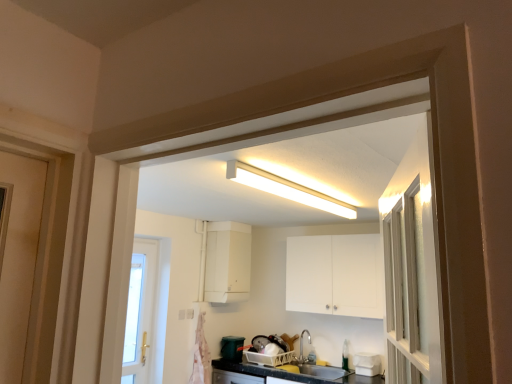
The width and height of the screenshot is (512, 384). What are the coordinates of `white matte cabinet at upper center, positioned as the 2th cabinetry in right-to-left order` in the screenshot? It's located at (226, 262).

What is the approximate width of white matte container at lower right?

9.58 inches.

The width and height of the screenshot is (512, 384). Identify the location of white matte container at lower right. (367, 364).

Image resolution: width=512 pixels, height=384 pixels. Identify the location of white matte cabinet at upper center, which appears as the first cabinetry when viewed from the right. (334, 275).

Which of these two, satin nickel faucet at lower center or white matte cabinet at upper center, which appears as the 1th cabinetry when viewed from the left, is thinner?

With smaller width is satin nickel faucet at lower center.

Is point (308, 339) more distant than point (224, 235)?

No, (308, 339) is closer to viewer.

Is satin nickel faucet at lower center positioned before white matte cabinet at upper center, positioned as the 2th cabinetry in right-to-left order?

Yes, it is in front of white matte cabinet at upper center, positioned as the 2th cabinetry in right-to-left order.

Who is smaller, satin nickel faucet at lower center or white matte cabinet at upper center, positioned as the 2th cabinetry in right-to-left order?

Smaller between the two is satin nickel faucet at lower center.

Which of these two, white fluorescent light at upper center or white matte container at lower right, is thinner?

white fluorescent light at upper center.

Is white fluorescent light at upper center far away from white matte container at lower right?

Indeed, white fluorescent light at upper center is not near white matte container at lower right.

From a real-world perspective, which is physically below, white fluorescent light at upper center or white matte container at lower right?

white matte container at lower right, from a real-world perspective.

Is white matte cabinet at upper center, which appears as the first cabinetry when viewed from the right, next to white matte cabinet at upper center, positioned as the 2th cabinetry in right-to-left order, and touching it?

No, white matte cabinet at upper center, which appears as the first cabinetry when viewed from the right, is not next to white matte cabinet at upper center, positioned as the 2th cabinetry in right-to-left order.

Is white matte cabinet at upper center, marked as the second cabinetry in a left-to-right arrangement, to the right of white matte cabinet at upper center, which appears as the 1th cabinetry when viewed from the left, from the viewer's perspective?

Yes.

Looking at this image, from a real-world perspective, which object rests below the other?

In real-world perspective, white matte cabinet at upper center, marked as the second cabinetry in a left-to-right arrangement, is lower.

Between white plastic electric outlet at lower center and white matte container at lower right, which one has more height?

With more height is white matte container at lower right.

Considering the sizes of objects white plastic electric outlet at lower center and white matte container at lower right in the image provided, who is bigger, white plastic electric outlet at lower center or white matte container at lower right?

Bigger between the two is white matte container at lower right.

How different are the orientations of white plastic electric outlet at lower center and white matte container at lower right in degrees?

90 degrees separate the facing orientations of white plastic electric outlet at lower center and white matte container at lower right.

Does white matte container at lower right come in front of white fluorescent light at upper center?

No.

Looking at this image, is white matte container at lower right aimed at white fluorescent light at upper center?

No, white matte container at lower right does not turn towards white fluorescent light at upper center.

Is white matte container at lower right outside of white fluorescent light at upper center?

white matte container at lower right lies outside white fluorescent light at upper center's area.

Which point is more forward, [380,359] or [343,208]?

The point [343,208] is in front.

From a real-world perspective, is white matte cabinet at upper center, positioned as the 2th cabinetry in right-to-left order, positioned over satin nickel faucet at lower center based on gravity?

Indeed, from a real-world perspective, white matte cabinet at upper center, positioned as the 2th cabinetry in right-to-left order, stands above satin nickel faucet at lower center.

Who is more distant, white matte cabinet at upper center, positioned as the 2th cabinetry in right-to-left order, or satin nickel faucet at lower center?

white matte cabinet at upper center, positioned as the 2th cabinetry in right-to-left order, is behind.

From the image's perspective, which is above, white matte cabinet at upper center, which appears as the 1th cabinetry when viewed from the left, or satin nickel faucet at lower center?

white matte cabinet at upper center, which appears as the 1th cabinetry when viewed from the left.

Based on their sizes in the image, would you say white matte container at lower right is bigger or smaller than white matte cabinet at upper center, marked as the second cabinetry in a left-to-right arrangement?

white matte container at lower right is smaller than white matte cabinet at upper center, marked as the second cabinetry in a left-to-right arrangement.

From the image's perspective, between white matte container at lower right and white matte cabinet at upper center, which appears as the first cabinetry when viewed from the right, which one is located above?

From the image's view, white matte cabinet at upper center, which appears as the first cabinetry when viewed from the right, is above.

Considering the positions of objects white matte container at lower right and white matte cabinet at upper center, which appears as the first cabinetry when viewed from the right, in the image provided, who is more to the right, white matte container at lower right or white matte cabinet at upper center, which appears as the first cabinetry when viewed from the right,?

From the viewer's perspective, white matte container at lower right appears more on the right side.

Which object is wider, white matte container at lower right or white matte cabinet at upper center, marked as the second cabinetry in a left-to-right arrangement?

Wider between the two is white matte cabinet at upper center, marked as the second cabinetry in a left-to-right arrangement.

You are a GUI agent. You are given a task and a screenshot of the screen. Output one action in this format:
    pyautogui.click(x=<x>, y=<y>)
    Task: Click on the tap below the white matte cabinet at upper center, which appears as the 1th cabinetry when viewed from the left (from the image's perspective)
    
    Given the screenshot: What is the action you would take?
    [x=302, y=345]

Locate an element on the screen. appliance on the right of white fluorescent light at upper center is located at coordinates (367, 364).

Which object lies further to the anchor point white matte cabinet at upper center, marked as the second cabinetry in a left-to-right arrangement, white matte cabinet at upper center, which appears as the 1th cabinetry when viewed from the left, or white fluorescent light at upper center?

white fluorescent light at upper center is positioned further to the anchor white matte cabinet at upper center, marked as the second cabinetry in a left-to-right arrangement.

Looking at the image, which one is located further to white matte cabinet at upper center, marked as the second cabinetry in a left-to-right arrangement, white plastic electric outlet at lower center or white matte container at lower right?

Based on the image, white plastic electric outlet at lower center appears to be further to white matte cabinet at upper center, marked as the second cabinetry in a left-to-right arrangement.

Looking at the image, which one is located closer to white matte container at lower right, satin nickel faucet at lower center or white fluorescent light at upper center?

Based on the image, satin nickel faucet at lower center appears to be nearer to white matte container at lower right.

From the image, which object appears to be nearer to white fluorescent light at upper center, white matte cabinet at upper center, positioned as the 2th cabinetry in right-to-left order, or white matte cabinet at upper center, which appears as the first cabinetry when viewed from the right?

Among the two, white matte cabinet at upper center, which appears as the first cabinetry when viewed from the right, is located nearer to white fluorescent light at upper center.

From the image, which object appears to be farther from satin nickel faucet at lower center, white matte cabinet at upper center, marked as the second cabinetry in a left-to-right arrangement, or white matte container at lower right?

Based on the image, white matte cabinet at upper center, marked as the second cabinetry in a left-to-right arrangement, appears to be further to satin nickel faucet at lower center.

Consider the image. Considering their positions, is white matte container at lower right positioned further to white matte cabinet at upper center, which appears as the 1th cabinetry when viewed from the left, than white fluorescent light at upper center?

Among the two, white fluorescent light at upper center is located further to white matte cabinet at upper center, which appears as the 1th cabinetry when viewed from the left.

From the image, which object appears to be farther from satin nickel faucet at lower center, white plastic electric outlet at lower center or white fluorescent light at upper center?

white fluorescent light at upper center is positioned further to the anchor satin nickel faucet at lower center.

Based on their spatial positions, is white matte container at lower right or white fluorescent light at upper center closer to white plastic electric outlet at lower center?

Among the two, white matte container at lower right is located nearer to white plastic electric outlet at lower center.

The width and height of the screenshot is (512, 384). I want to click on cabinetry between white plastic electric outlet at lower center and satin nickel faucet at lower center in the horizontal direction, so click(x=226, y=262).

Locate an element on the screen. cabinetry positioned between white fluorescent light at upper center and white matte cabinet at upper center, which appears as the 1th cabinetry when viewed from the left, from near to far is located at coordinates (334, 275).

Find the location of a particular element. This screenshot has width=512, height=384. tap between white plastic electric outlet at lower center and white matte container at lower right from left to right is located at coordinates (302, 345).

Find the location of a particular element. cabinetry situated between white matte cabinet at upper center, which appears as the 1th cabinetry when viewed from the left, and white matte container at lower right from left to right is located at coordinates (334, 275).